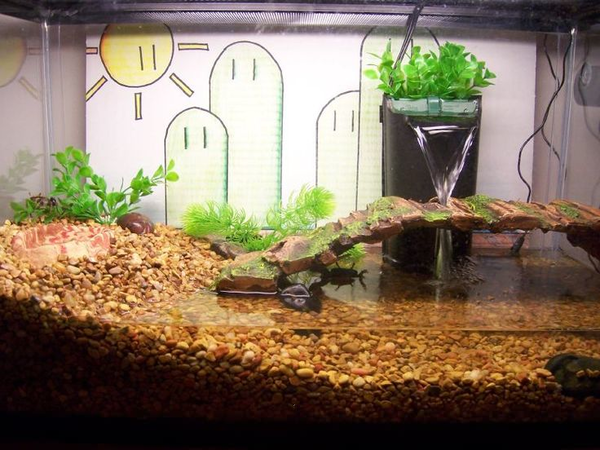
You are a GUI agent. You are given a task and a screenshot of the screen. Output one action in this format:
    pyautogui.click(x=<x>, y=<y>)
    Task: Click on the top edge of aquarium
    The image size is (600, 450).
    Given the screenshot: What is the action you would take?
    pyautogui.click(x=468, y=14)